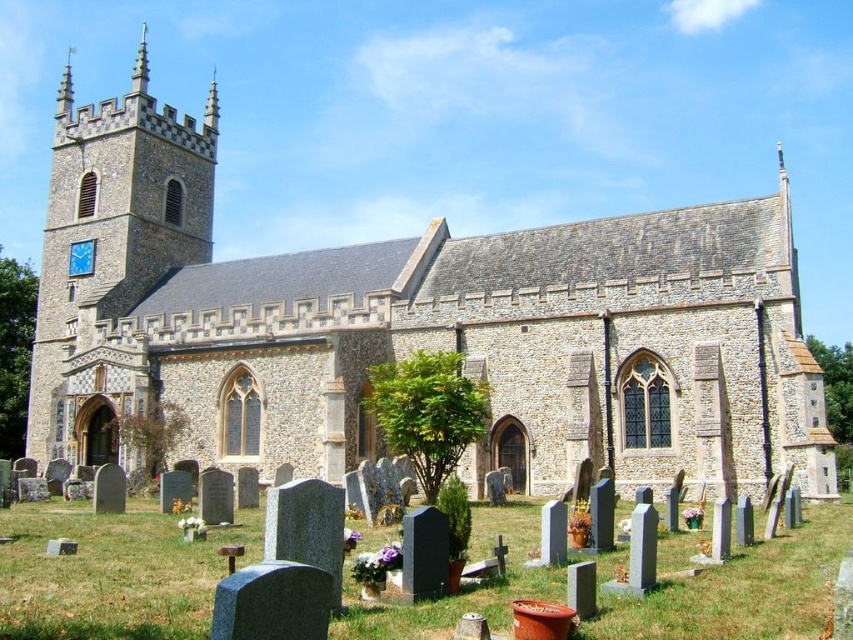
This screenshot has height=640, width=853. Find the location of `metallic clock face at upper left`. metallic clock face at upper left is located at coordinates click(x=80, y=257).

Identify the location of metallic clock face at upper left. (80, 257).

Which is in front, point (294, 433) or point (61, 432)?

Point (294, 433)

Based on the photo, can you confirm if stone church at center is taller than matte brick tower at left?

No.

Which is in front, point (521, 483) or point (45, 280)?

Point (521, 483)

At what (x,y) coordinates should I click in order to perform the action: click on stone church at center. Please return your answer as a coordinate pair (x, y). The height and width of the screenshot is (640, 853). Looking at the image, I should click on point(415,326).

Is matte brick tower at left smaller than metallic clock face at upper left?

No, matte brick tower at left is not smaller than metallic clock face at upper left.

Where is `matte brick tower at left`? matte brick tower at left is located at coordinates (111, 259).

The image size is (853, 640). Identify the location of matte brick tower at left. (111, 259).